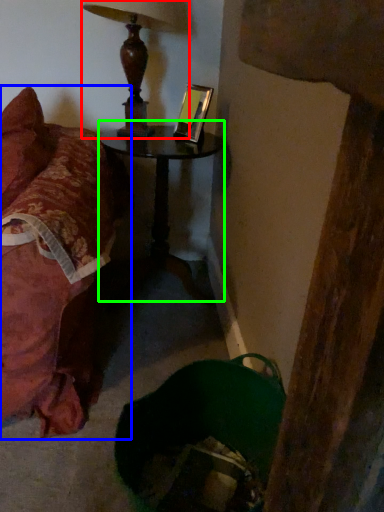
Question: Based on their relative distances, which object is nearer to lamp (highlighted by a red box)? Choose from furniture (highlighted by a blue box) and table (highlighted by a green box).

Choices:
 (A) furniture
 (B) table

Answer: (B)